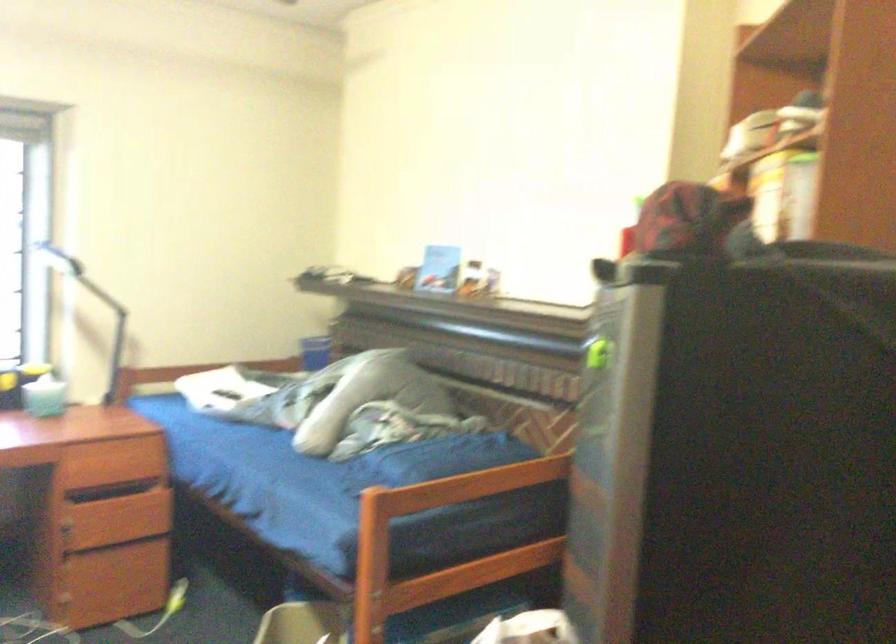
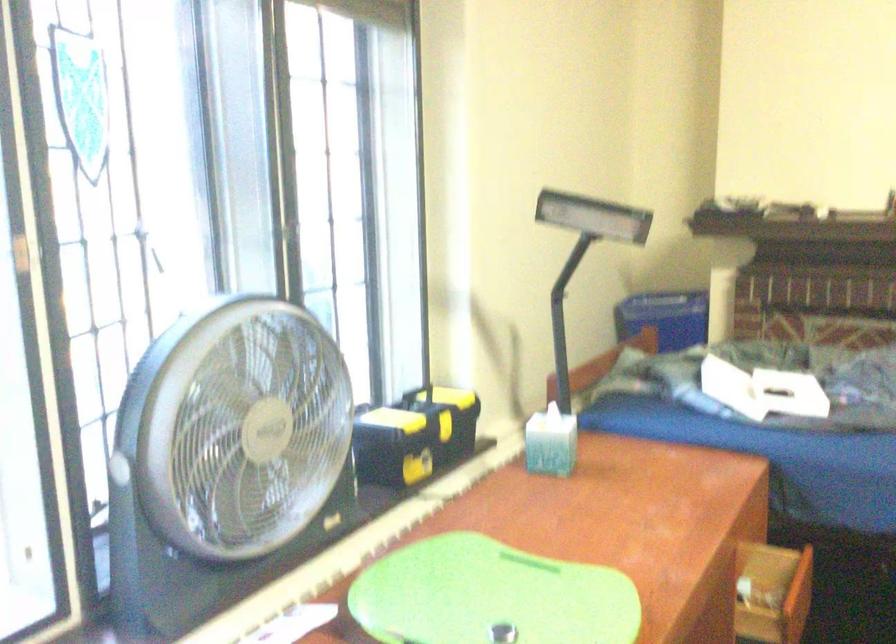
What movement of the cameraman would produce the second image?

The cameraman moved toward left, forward.